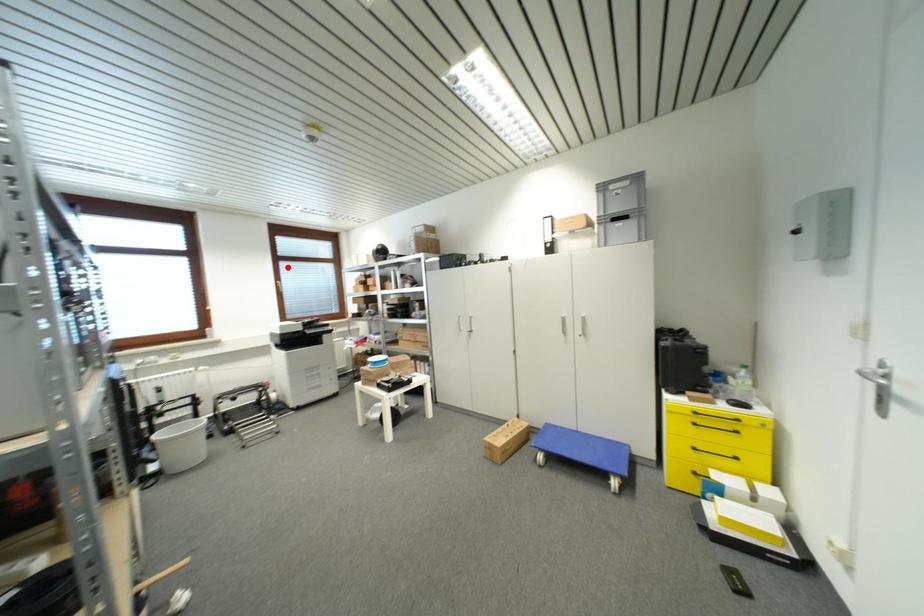
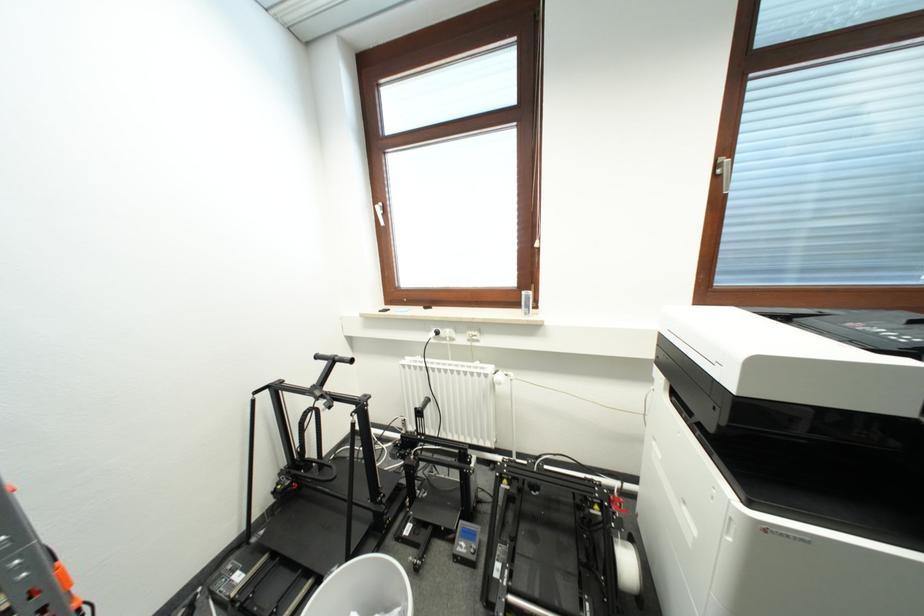
Question: I am providing you with two images of the same scene from different viewpoints. Image1 has a red point marked. In image2, the corresponding 3D location appears at what relative position? Reply with the corresponding letter.

Choices:
 (A) Closer
 (B) Farther

Answer: (B)